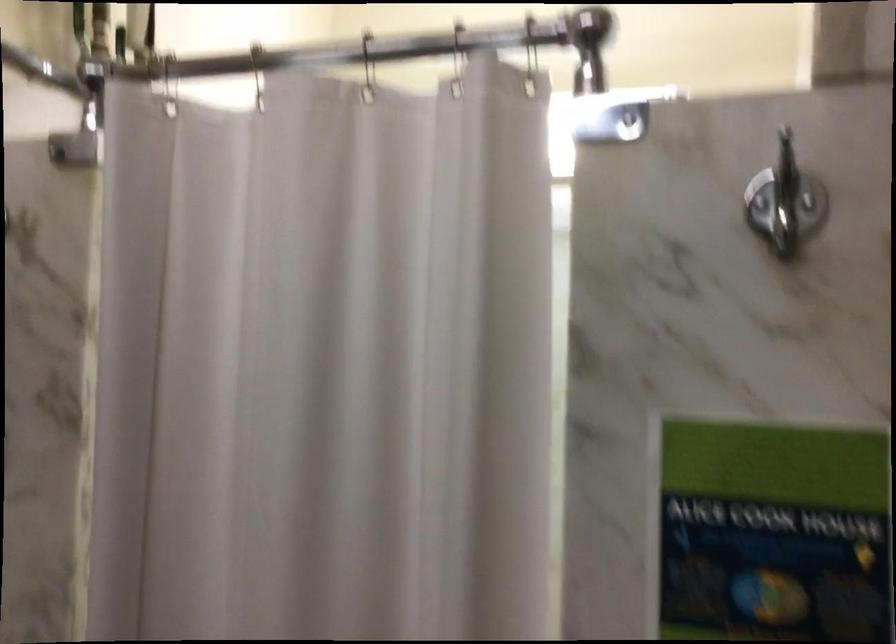
Describe the element at coordinates (786, 198) in the screenshot. I see `the metal wall hook` at that location.